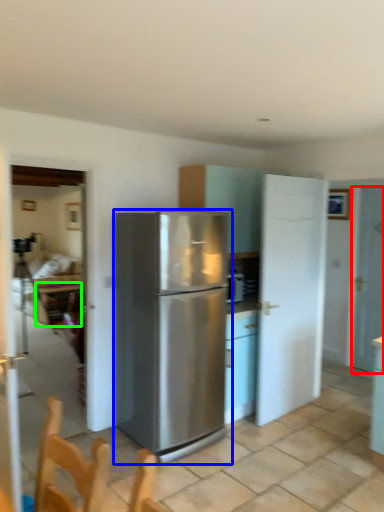
Question: Which is nearer to the door (highlighted by a red box)? refrigerator (highlighted by a blue box) or table (highlighted by a green box).

Choices:
 (A) refrigerator
 (B) table

Answer: (A)